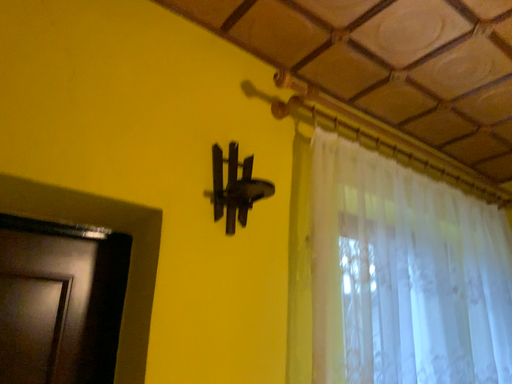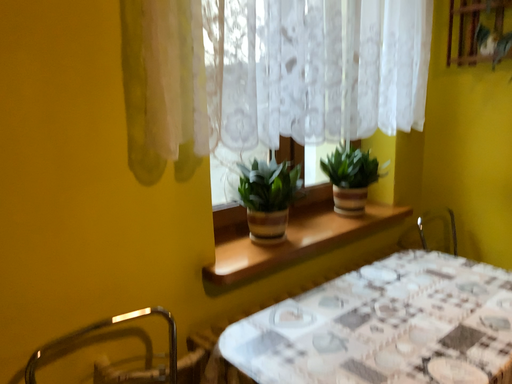
Question: Which way did the camera rotate in the video?

Choices:
 (A) rotated left
 (B) rotated right

Answer: (B)